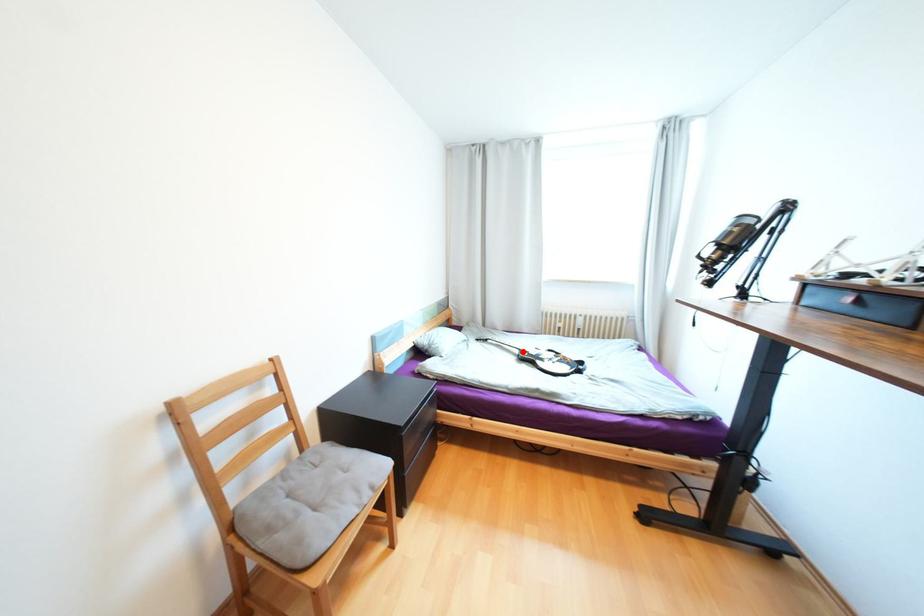
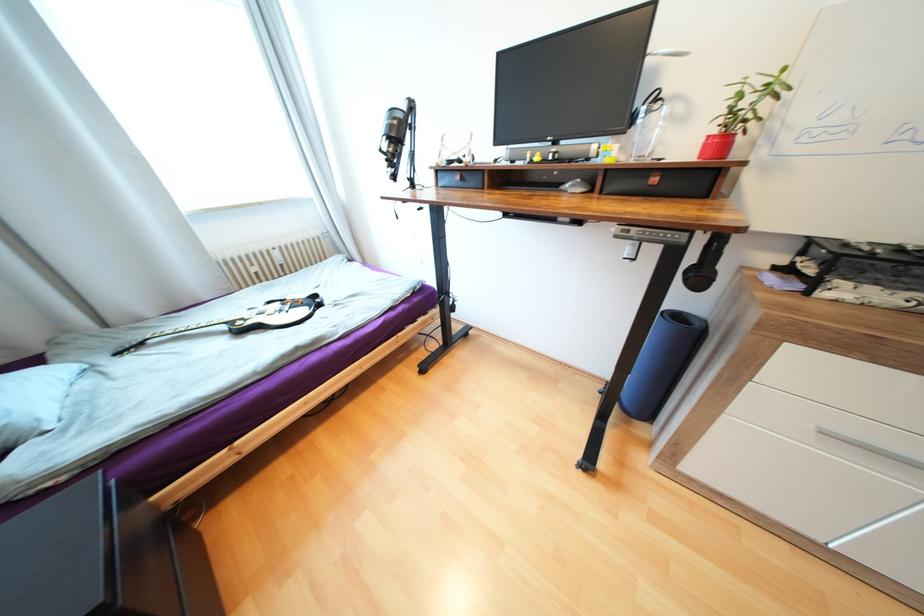
Where in the second image is the point corresponding to the highlighted location from the first image?

(229, 328)